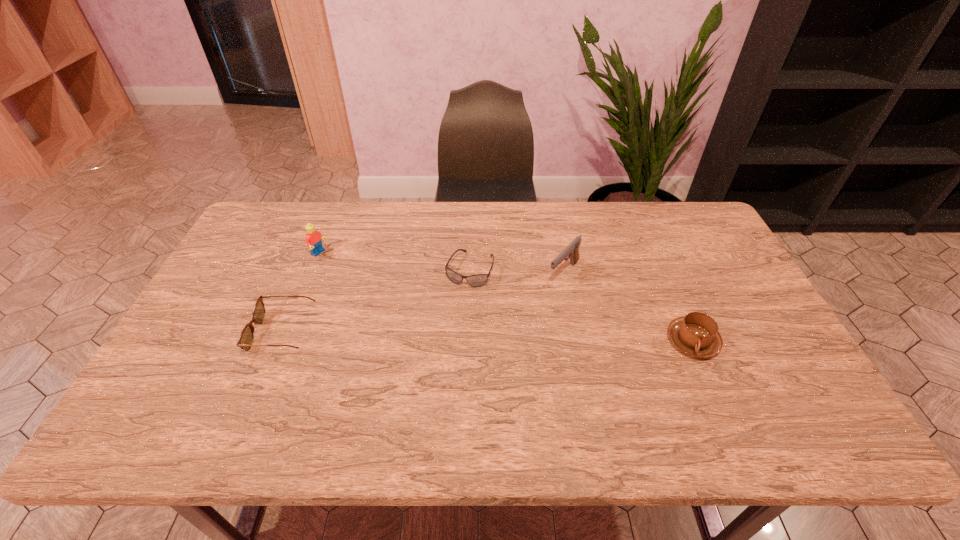
Identify the location of vacant space on the desktop that is between the spectacles and the rightmost object and is positioned at the barrel of the pistol. Image resolution: width=960 pixels, height=540 pixels. (502, 337).

The height and width of the screenshot is (540, 960). What are the coordinates of `vacant space on the desktop that is between the spectacles and the cappuccino and is positioned on the lenses of the third object from right to left` in the screenshot? It's located at (444, 336).

The width and height of the screenshot is (960, 540). In order to click on vacant spot on the desktop that is between the spectacles and the rightmost object and is positioned on the face of the Lego in this screenshot , I will do `click(482, 336)`.